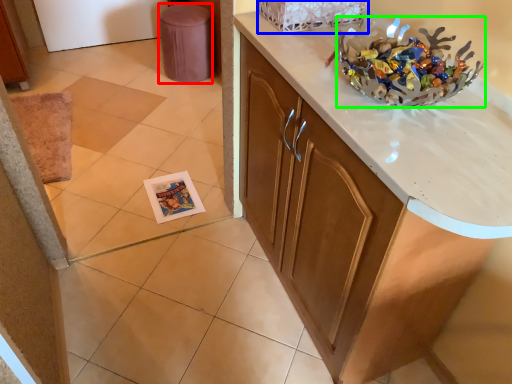
Question: Which object is positioned farthest from stool (highlighted by a red box)? Select from basket (highlighted by a blue box) and stuff (highlighted by a green box).

Choices:
 (A) basket
 (B) stuff

Answer: (B)